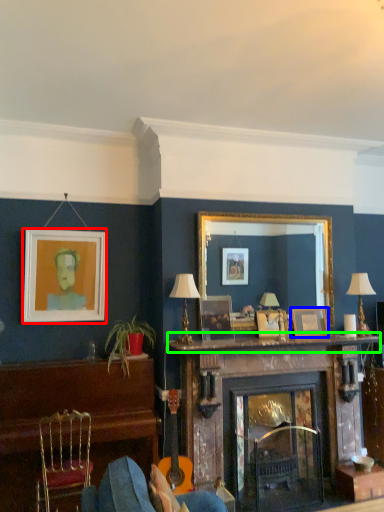
Question: Which object is positioned farthest from picture frame (highlighted by a red box)? Select from picture frame (highlighted by a blue box) and mantle (highlighted by a green box).

Choices:
 (A) picture frame
 (B) mantle

Answer: (A)